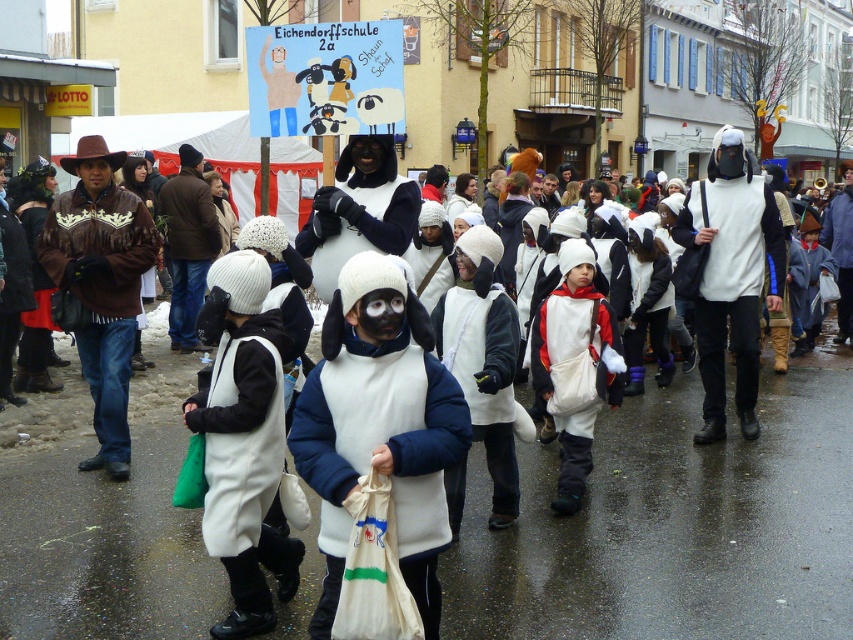
Does white fleece costume at center appear over white matte snowsuit at center?

No, white fleece costume at center is not above white matte snowsuit at center.

Looking at this image, does white fleece costume at center appear on the left side of white matte snowsuit at center?

Yes, white fleece costume at center is to the left of white matte snowsuit at center.

Measure the distance between point (x=341, y=572) and camera.

They are 3.64 meters apart.

Image resolution: width=853 pixels, height=640 pixels. What are the coordinates of `white fleece costume at center` in the screenshot? It's located at (379, 428).

Between white matte vest at center and white matte snowsuit at center, which one appears on the left side from the viewer's perspective?

From the viewer's perspective, white matte snowsuit at center appears more on the left side.

Does white matte vest at center have a lesser width compared to white matte snowsuit at center?

Incorrect, white matte vest at center's width is not less than white matte snowsuit at center's.

Is point (729, 144) closer to camera compared to point (447, 502)?

No.

The width and height of the screenshot is (853, 640). Find the location of `white matte vest at center`. white matte vest at center is located at coordinates (730, 275).

Is brown leather jacket at left taller than white matte snowsuit at center?

Yes, brown leather jacket at left is taller than white matte snowsuit at center.

Is brown leather jacket at left below white matte snowsuit at center?

No, brown leather jacket at left is not below white matte snowsuit at center.

Between point (128, 444) and point (490, 276), which one is positioned behind?

The point (128, 444) is behind.

I want to click on brown leather jacket at left, so click(102, 284).